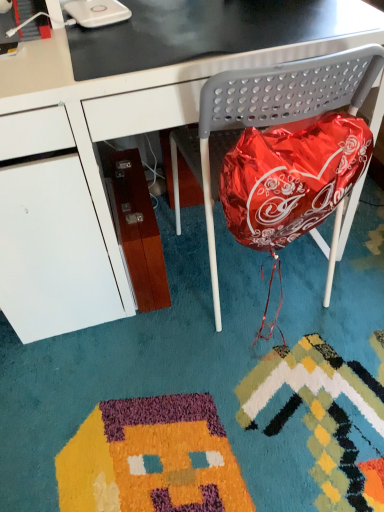
Question: Can you confirm if black glossy table at upper center is shorter than metallic gray folding chair at center?

Choices:
 (A) yes
 (B) no

Answer: (A)

Question: Does black glossy table at upper center appear on the left side of metallic gray folding chair at center?

Choices:
 (A) no
 (B) yes

Answer: (B)

Question: From the image's perspective, would you say black glossy table at upper center is shown under metallic gray folding chair at center?

Choices:
 (A) yes
 (B) no

Answer: (B)

Question: Can you confirm if black glossy table at upper center is positioned to the right of metallic gray folding chair at center?

Choices:
 (A) no
 (B) yes

Answer: (A)

Question: Is black glossy table at upper center bigger than metallic gray folding chair at center?

Choices:
 (A) yes
 (B) no

Answer: (B)

Question: From a real-world perspective, is black glossy table at upper center physically located above or below black glossy desk at center?

Choices:
 (A) above
 (B) below

Answer: (A)

Question: Is black glossy table at upper center inside or outside of black glossy desk at center?

Choices:
 (A) inside
 (B) outside

Answer: (A)

Question: Does point (344, 13) appear closer or farther from the camera than point (57, 258)?

Choices:
 (A) closer
 (B) farther

Answer: (A)

Question: Is black glossy table at upper center to the left or to the right of black glossy desk at center in the image?

Choices:
 (A) right
 (B) left

Answer: (A)

Question: Is black glossy desk at center situated inside black glossy table at upper center or outside?

Choices:
 (A) outside
 (B) inside

Answer: (A)

Question: Is black glossy desk at center taller or shorter than black glossy table at upper center?

Choices:
 (A) tall
 (B) short

Answer: (A)

Question: In the image, is black glossy desk at center positioned in front of or behind black glossy table at upper center?

Choices:
 (A) front
 (B) behind

Answer: (A)

Question: Looking at their shapes, would you say black glossy desk at center is wider or thinner than black glossy table at upper center?

Choices:
 (A) wide
 (B) thin

Answer: (A)

Question: Considering the positions of black glossy desk at center and metallic gray folding chair at center in the image, is black glossy desk at center taller or shorter than metallic gray folding chair at center?

Choices:
 (A) tall
 (B) short

Answer: (A)

Question: Is point (246, 39) positioned closer to the camera than point (291, 116)?

Choices:
 (A) closer
 (B) farther

Answer: (B)